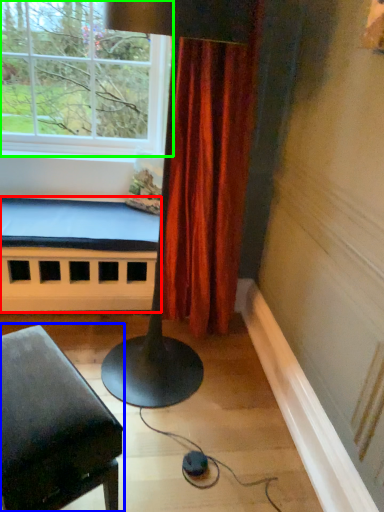
Question: Which is nearer to the bed frame (highlighted by a red box)? furniture (highlighted by a blue box) or window (highlighted by a green box).

Choices:
 (A) furniture
 (B) window

Answer: (B)